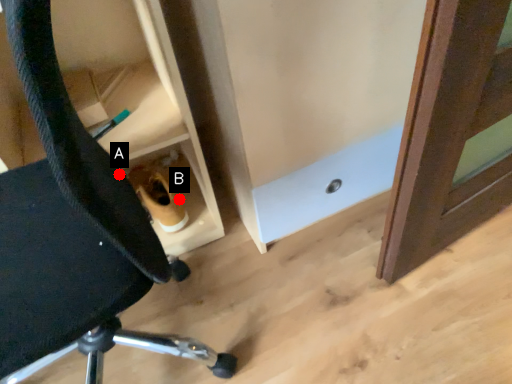
Question: Two points are circled on the image, labeled by A and B beside each circle. Among these points, which one is farthest from the camera?

Choices:
 (A) A is further
 (B) B is further

Answer: (B)